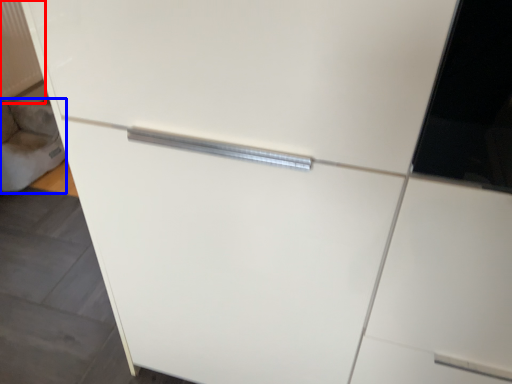
Question: Among these objects, which one is nearest to the camera, radiator (highlighted by a red box) or gray (highlighted by a blue box)?

Choices:
 (A) radiator
 (B) gray

Answer: (B)